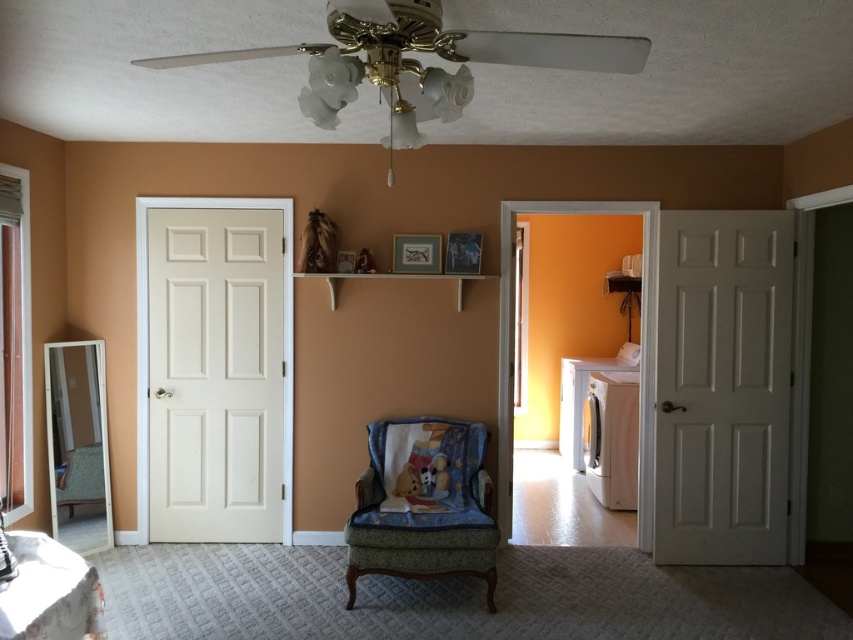
Question: Observing the image, what is the correct spatial positioning of white plastic fan at upper center in reference to velvet green armchair at center?

Choices:
 (A) below
 (B) above

Answer: (B)

Question: Can you confirm if white plastic fan at upper center is positioned to the left of velvet green armchair at center?

Choices:
 (A) yes
 (B) no

Answer: (A)

Question: Which of the following is the closest to the observer?

Choices:
 (A) (416, 538)
 (B) (146, 61)

Answer: (B)

Question: Which point is farther to the camera?

Choices:
 (A) velvet green armchair at center
 (B) white plastic fan at upper center

Answer: (A)

Question: Which object is closer to the camera taking this photo?

Choices:
 (A) white plastic fan at upper center
 (B) velvet green armchair at center

Answer: (A)

Question: Does white plastic fan at upper center appear under velvet green armchair at center?

Choices:
 (A) no
 (B) yes

Answer: (A)